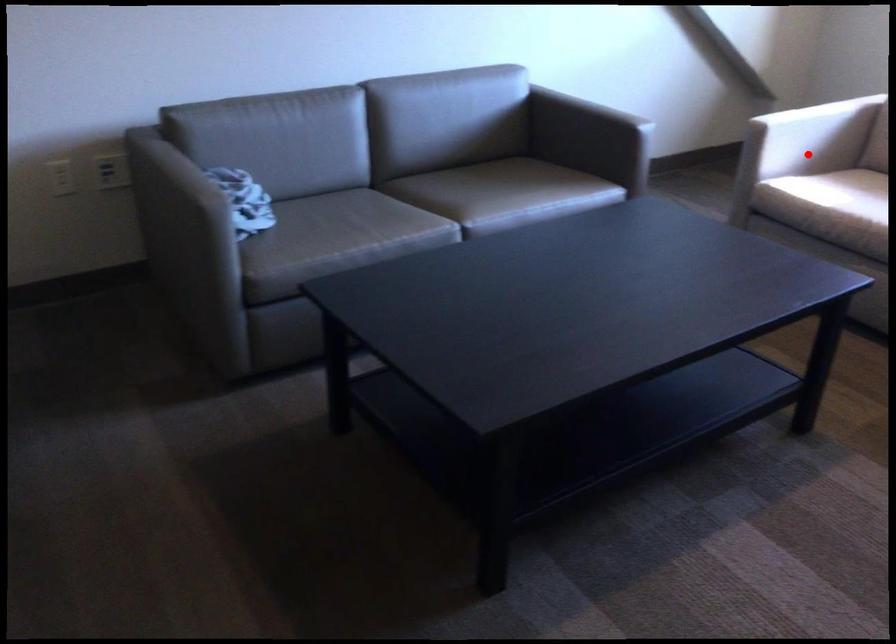
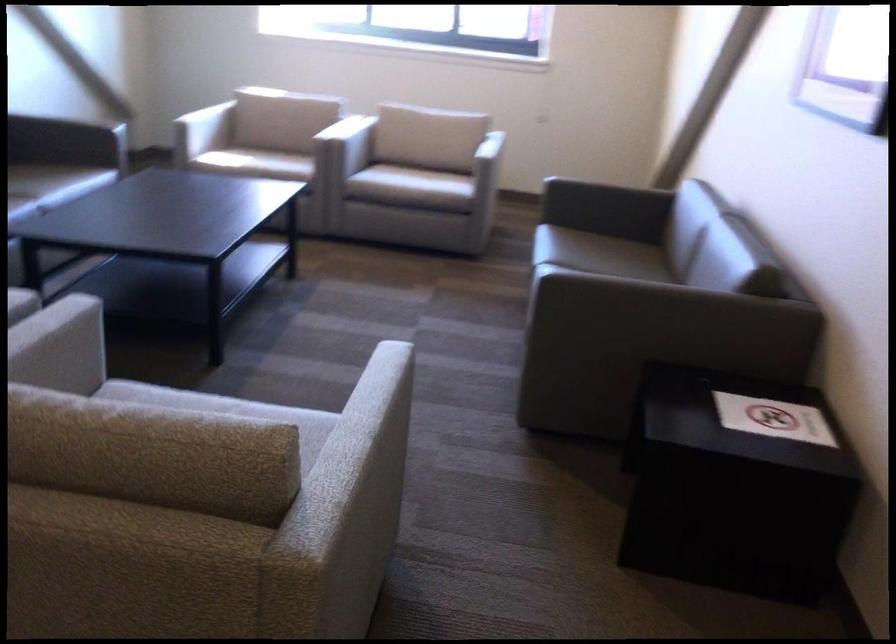
Question: A red point is marked in image1. In image2, is the corresponding 3D point closer to the camera or farther? Reply with the corresponding letter.

Choices:
 (A) The corresponding 3D point is closer.
 (B) The corresponding 3D point is farther.

Answer: (B)